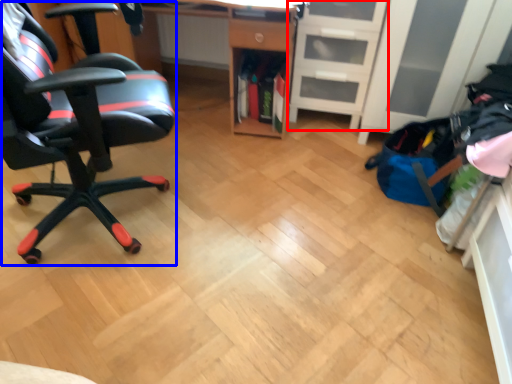
Question: Which object appears farthest to the camera in this image, file cabinet (highlighted by a red box) or chair (highlighted by a blue box)?

Choices:
 (A) file cabinet
 (B) chair

Answer: (A)